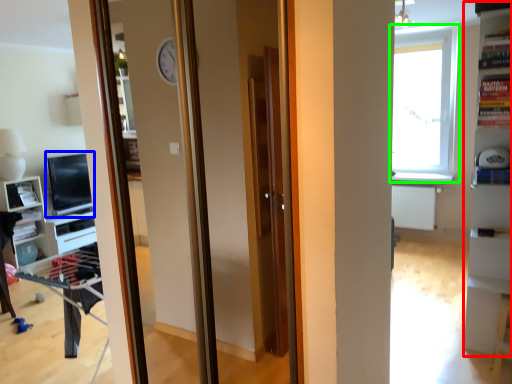
Question: Which object is the closest to the bookshelf (highlighted by a red box)? Choose among these: computer monitor (highlighted by a blue box) or window (highlighted by a green box).

Choices:
 (A) computer monitor
 (B) window

Answer: (B)